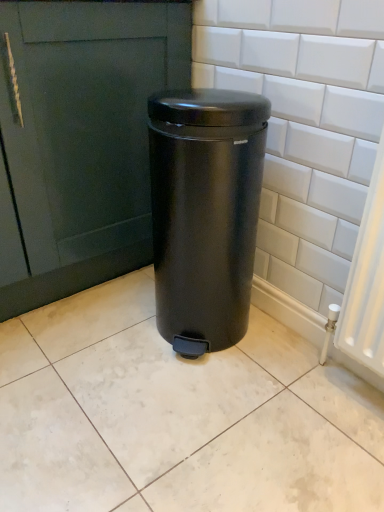
Locate an element on the screen. unoccupied region to the right of matte black trash can at center is located at coordinates (295, 356).